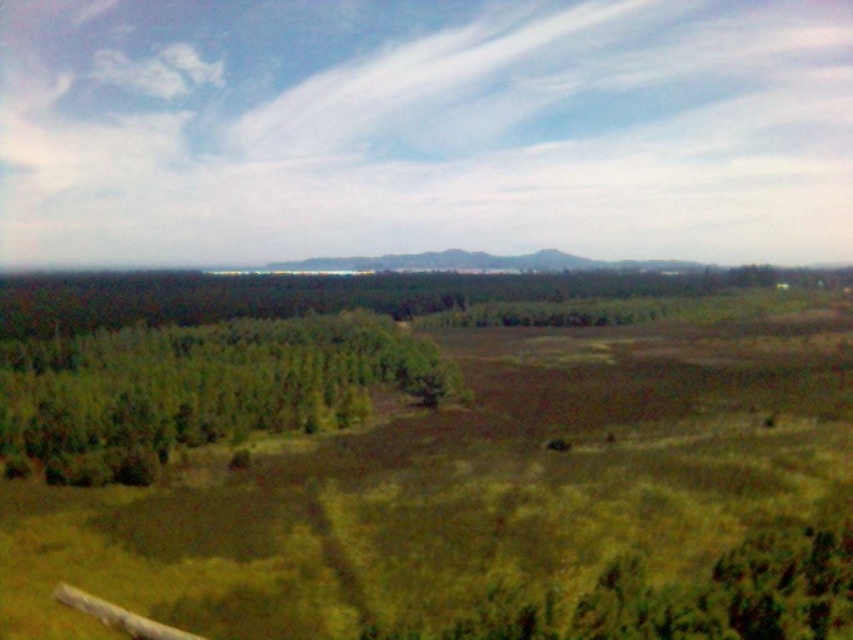
You are a hiker standing at the edge of the green grassy field at center and want to reach the green leafy trees at left. Which direction should you walk to get there?

The green grassy field at center is located above the green leafy trees at left, so you should walk downward to reach them.

You are standing at the center of the image. Which direction should you walk to reach the green grassy field at center?

The green grassy field at center is already at your current position since you are standing at the center of the image.

From the picture: You are a landscape architect planning to install a walking path between the green grassy field at center and the green leafy trees at left. The path requires a minimum of 80 feet of space to accommodate safety features. Based on the scene, is the current distance sufficient?

The distance between the green grassy field at center and the green leafy trees at left is 78.33 feet, which is less than the required 80 feet. Therefore, the current distance is insufficient for the path.